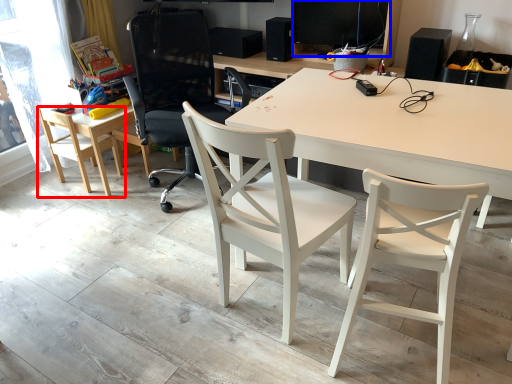
Question: Which object appears farthest to the camera in this image, chair (highlighted by a red box) or computer monitor (highlighted by a blue box)?

Choices:
 (A) chair
 (B) computer monitor

Answer: (A)